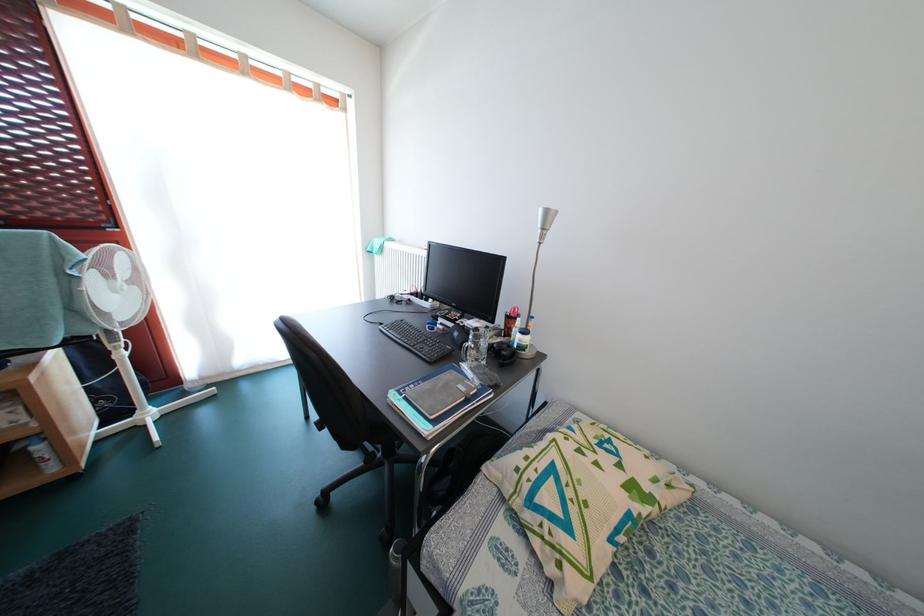
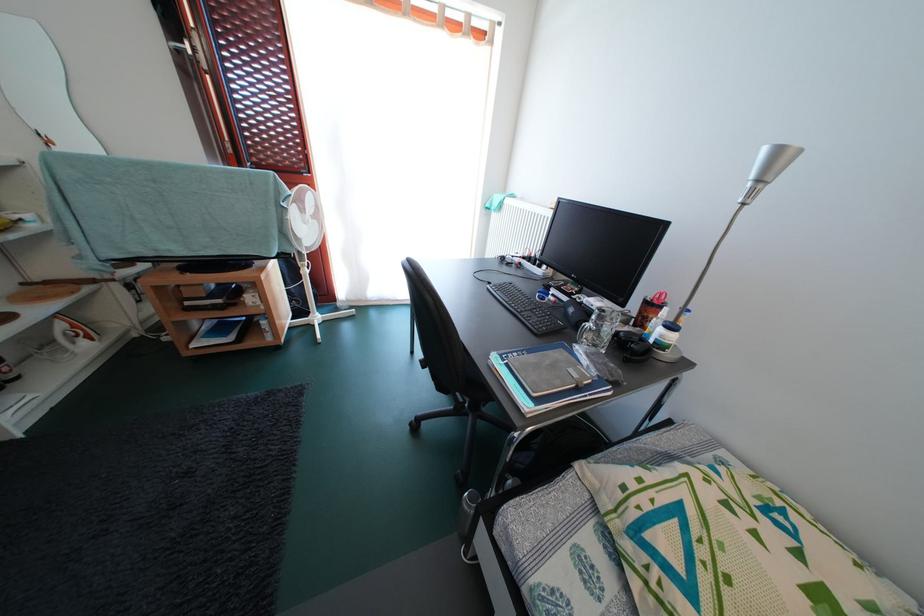
In the second image, find the point that corresponds to point 387,334 in the first image.

(495, 294)